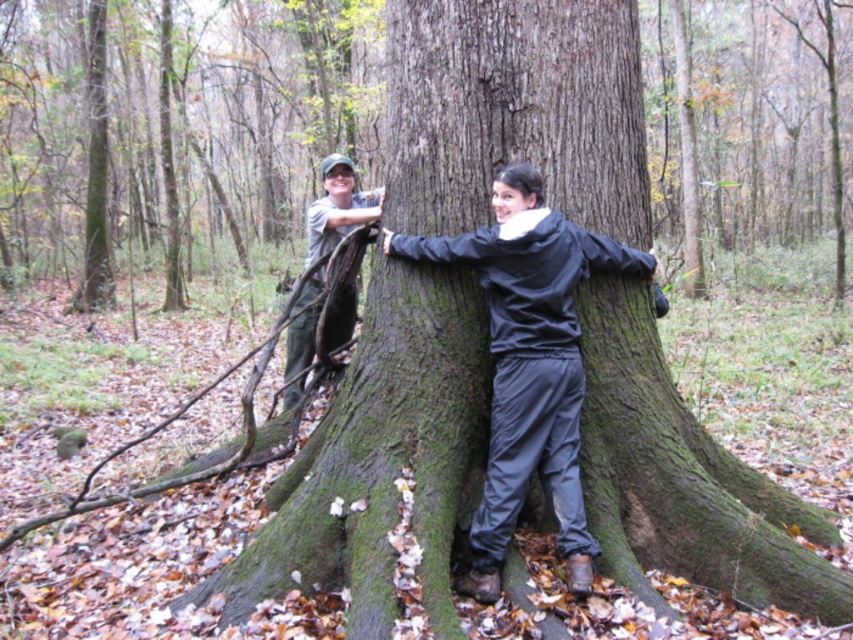
Question: Among these objects, which one is nearest to the camera?

Choices:
 (A) matte gray jacket at center
 (B) brushed metal branch at left

Answer: (A)

Question: Does matte gray jacket at center lie in front of brushed metal branch at left?

Choices:
 (A) yes
 (B) no

Answer: (A)

Question: Can you confirm if matte gray jacket at center is positioned above brushed metal branch at left?

Choices:
 (A) no
 (B) yes

Answer: (A)

Question: Observing the image, what is the correct spatial positioning of matte gray jacket at center in reference to brushed metal branch at left?

Choices:
 (A) right
 (B) left

Answer: (A)